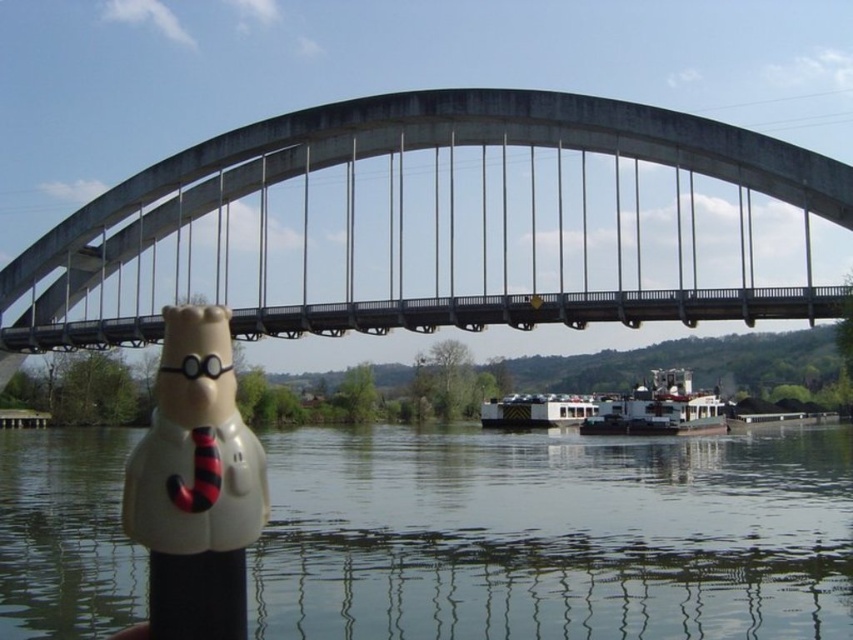
Question: Which object is farther from the camera taking this photo?

Choices:
 (A) concrete bridge at center
 (B) white matte boat at center
 (C) white matte figurine at lower left
 (D) white matte houseboat at center

Answer: (D)

Question: Does concrete bridge at center appear on the left side of white matte figurine at lower left?

Choices:
 (A) yes
 (B) no

Answer: (B)

Question: Which point is farther to the camera?

Choices:
 (A) concrete bridge at center
 (B) white matte figurine at lower left

Answer: (A)

Question: Does white matte boat at center have a smaller size compared to white matte houseboat at center?

Choices:
 (A) no
 (B) yes

Answer: (A)

Question: Can you confirm if concrete bridge at center is positioned to the left of transparent plastic water at lower center?

Choices:
 (A) no
 (B) yes

Answer: (B)

Question: Which object appears farthest from the camera in this image?

Choices:
 (A) white matte boat at center
 (B) transparent plastic water at lower center
 (C) white matte houseboat at center

Answer: (C)